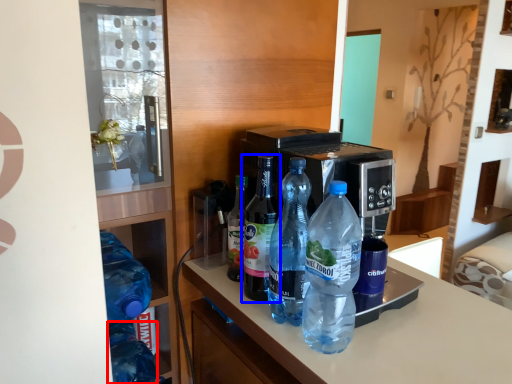
Question: Which object appears closest to the camera in this image, bottle (highlighted by a red box) or bottle (highlighted by a blue box)?

Choices:
 (A) bottle
 (B) bottle

Answer: (B)